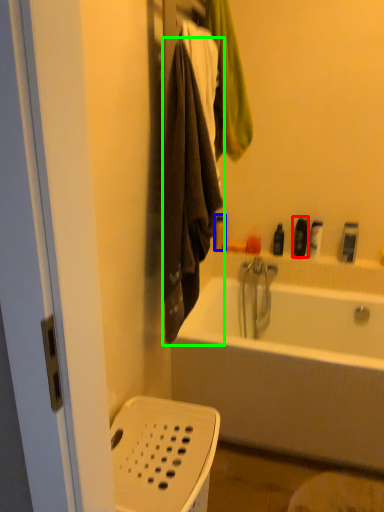
Question: Which is farther away from toiletry (highlighted by a red box)? toiletry (highlighted by a blue box) or towel/napkin (highlighted by a green box)?

Choices:
 (A) toiletry
 (B) towel/napkin

Answer: (B)